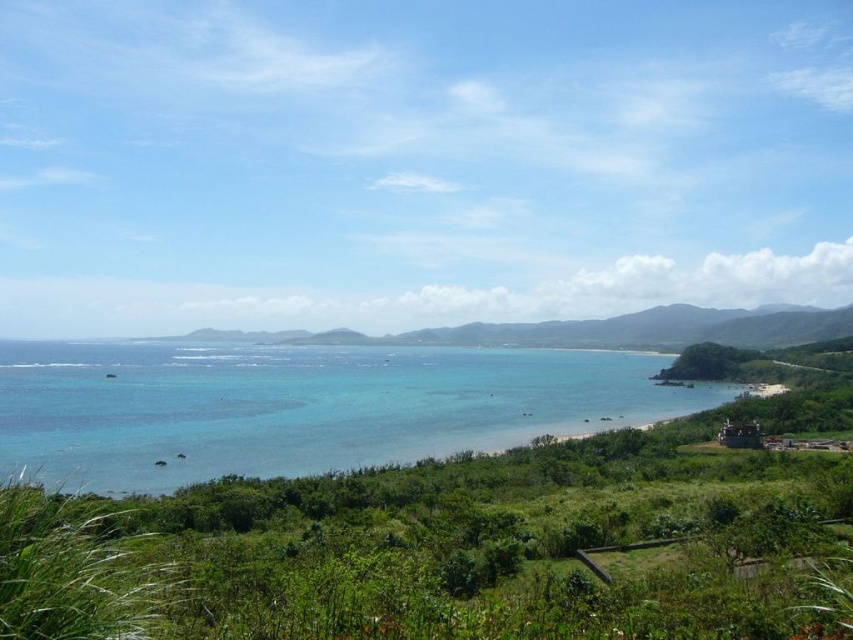
You are standing on the beach and want to walk to the clear blue water at center and the green grassy hillside at center. Which path would be shorter if you start from the beach?

The path to the clear blue water at center is shorter because its width surpasses the green grassy hillside at center, meaning it is closer to the beach.

You are standing on the beach and looking at the image. Which object takes up more area in the scene, the green leafy vegetation at center or the clear blue water at center?

The clear blue water at center occupies more area than the green leafy vegetation at center in the scene.